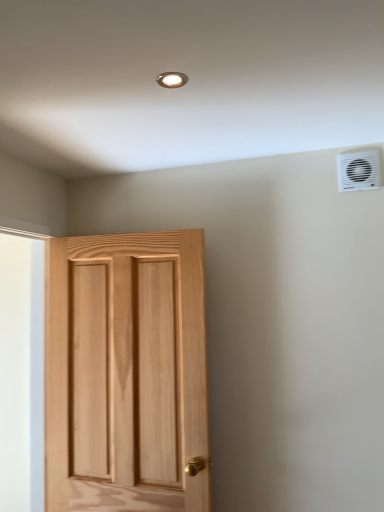
Find the location of `natural wood door at left`. natural wood door at left is located at coordinates (126, 362).

Find the location of a particular element. This screenshot has height=512, width=384. white plastic air conditioning unit at upper right is located at coordinates (359, 170).

From the image's perspective, is matte silver light fixture at upper center over natural wood door at left?

Indeed, from the image's perspective, matte silver light fixture at upper center is shown above natural wood door at left.

Which is closer, (x=158, y=83) or (x=172, y=262)?

The point (x=158, y=83) is closer.

From a real-world perspective, which is physically below, matte silver light fixture at upper center or natural wood door at left?

From a 3D spatial view, natural wood door at left is below.

From the image's perspective, between white plastic air conditioning unit at upper right and matte silver light fixture at upper center, which one is located above?

matte silver light fixture at upper center appears higher in the image.

Looking at their sizes, would you say white plastic air conditioning unit at upper right is wider or thinner than matte silver light fixture at upper center?

Clearly, white plastic air conditioning unit at upper right has less width compared to matte silver light fixture at upper center.

Identify the location of light fixture above the white plastic air conditioning unit at upper right (from a real-world perspective). The height and width of the screenshot is (512, 384). (172, 79).

Which of these two, white plastic air conditioning unit at upper right or matte silver light fixture at upper center, stands shorter?

matte silver light fixture at upper center is shorter.

Is natural wood door at left located outside matte silver light fixture at upper center?

Yes.

How distant is natural wood door at left from matte silver light fixture at upper center?

natural wood door at left is 1.21 meters from matte silver light fixture at upper center.

Image resolution: width=384 pixels, height=512 pixels. What are the coordinates of `door that is on the left side of matte silver light fixture at upper center` in the screenshot? It's located at (126, 362).

What's the angular difference between natural wood door at left and matte silver light fixture at upper center's facing directions?

There is a 0.255-degree angle between the facing directions of natural wood door at left and matte silver light fixture at upper center.

From the image's perspective, between natural wood door at left and white plastic air conditioning unit at upper right, who is located below?

natural wood door at left, from the image's perspective.

Considering the positions of point (108, 426) and point (350, 163), is point (108, 426) closer or farther from the camera than point (350, 163)?

Point (108, 426) appears to be farther away from the viewer than point (350, 163).

Measure the distance from natural wood door at left to white plastic air conditioning unit at upper right.

natural wood door at left is 1.15 meters from white plastic air conditioning unit at upper right.

Locate an element on the screen. This screenshot has height=512, width=384. air conditioning that is above the natural wood door at left (from a real-world perspective) is located at coordinates (359, 170).

Between white plastic air conditioning unit at upper right and natural wood door at left, which one has smaller size?

white plastic air conditioning unit at upper right.

This screenshot has height=512, width=384. What are the coordinates of `door on the left of white plastic air conditioning unit at upper right` in the screenshot? It's located at (126, 362).

Is the depth of white plastic air conditioning unit at upper right greater than that of natural wood door at left?

Yes.

Considering the sizes of matte silver light fixture at upper center and white plastic air conditioning unit at upper right in the image, is matte silver light fixture at upper center wider or thinner than white plastic air conditioning unit at upper right?

Clearly, matte silver light fixture at upper center has more width compared to white plastic air conditioning unit at upper right.

Looking at this image, which object is positioned more to the right, matte silver light fixture at upper center or white plastic air conditioning unit at upper right?

Positioned to the right is white plastic air conditioning unit at upper right.

Is matte silver light fixture at upper center with white plastic air conditioning unit at upper right?

No, matte silver light fixture at upper center is not next to white plastic air conditioning unit at upper right.

Who is taller, matte silver light fixture at upper center or white plastic air conditioning unit at upper right?

Standing taller between the two is white plastic air conditioning unit at upper right.

There is a natural wood door at left. Where is `light fixture above it (from a real-world perspective)`? The height and width of the screenshot is (512, 384). light fixture above it (from a real-world perspective) is located at coordinates (172, 79).

In the image, there is a white plastic air conditioning unit at upper right. Identify the location of light fixture above it (from the image's perspective). (172, 79).

Looking at the image, which one is located further to matte silver light fixture at upper center, white plastic air conditioning unit at upper right or natural wood door at left?

natural wood door at left is further to matte silver light fixture at upper center.

Based on their spatial positions, is natural wood door at left or matte silver light fixture at upper center further from white plastic air conditioning unit at upper right?

natural wood door at left lies further to white plastic air conditioning unit at upper right than the other object.

From the picture: From the image, which object appears to be farther from white plastic air conditioning unit at upper right, matte silver light fixture at upper center or natural wood door at left?

The object further to white plastic air conditioning unit at upper right is natural wood door at left.

In the scene shown: Looking at the image, which one is located closer to natural wood door at left, white plastic air conditioning unit at upper right or matte silver light fixture at upper center?

white plastic air conditioning unit at upper right is closer to natural wood door at left.

When comparing their distances from natural wood door at left, does matte silver light fixture at upper center or white plastic air conditioning unit at upper right seem closer?

white plastic air conditioning unit at upper right lies closer to natural wood door at left than the other object.

Which object lies further to the anchor point matte silver light fixture at upper center, natural wood door at left or white plastic air conditioning unit at upper right?

natural wood door at left.

Find the location of a particular element. air conditioning between matte silver light fixture at upper center and natural wood door at left from top to bottom is located at coordinates (359, 170).